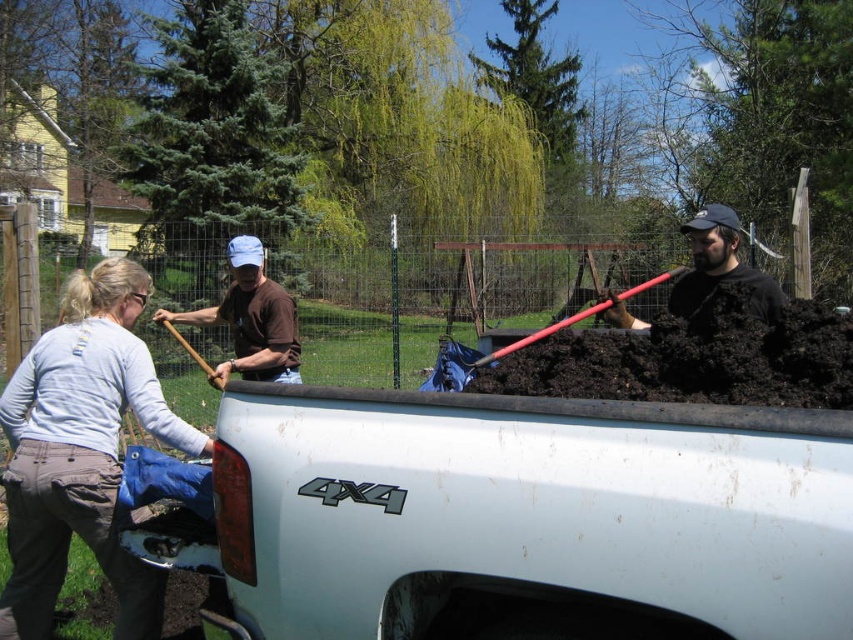
Question: Is brown cotton shirt at upper center above matte black shovel at center?

Choices:
 (A) no
 (B) yes

Answer: (A)

Question: Which of the following is the closest to the observer?

Choices:
 (A) (245, 241)
 (B) (766, 282)
 (C) (35, 352)

Answer: (C)

Question: Estimate the real-world distances between objects in this image. Which object is farther from the matte black shovel at center?

Choices:
 (A) light blue cotton shirt at left
 (B) brown cotton shirt at upper center

Answer: (A)

Question: Is brown cotton shirt at upper center thinner than matte black shovel at center?

Choices:
 (A) no
 (B) yes

Answer: (A)

Question: Which object is positioned closest to the brown cotton shirt at upper center?

Choices:
 (A) light blue cotton shirt at left
 (B) matte black shovel at center

Answer: (A)

Question: In this image, where is light blue cotton shirt at left located relative to brown cotton shirt at upper center?

Choices:
 (A) above
 (B) below

Answer: (B)